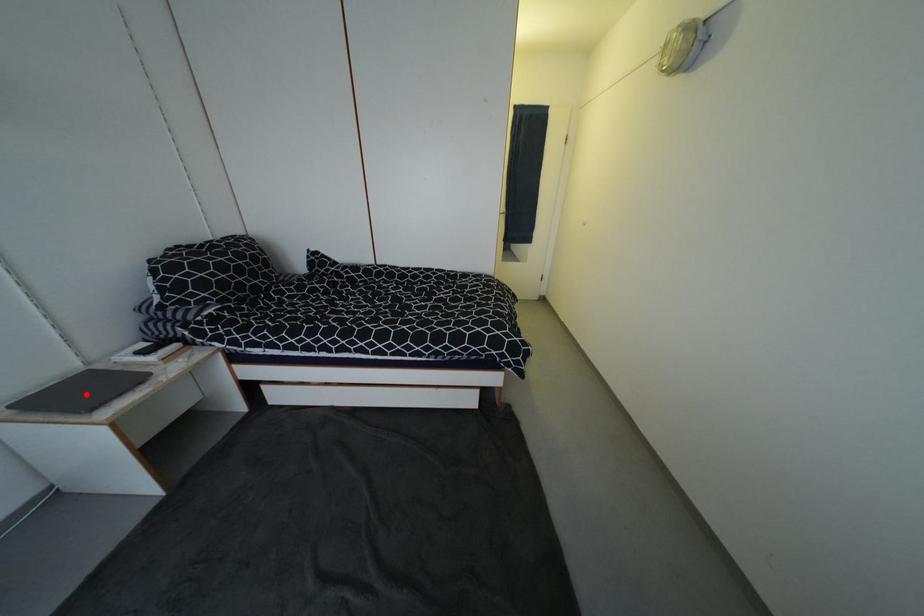
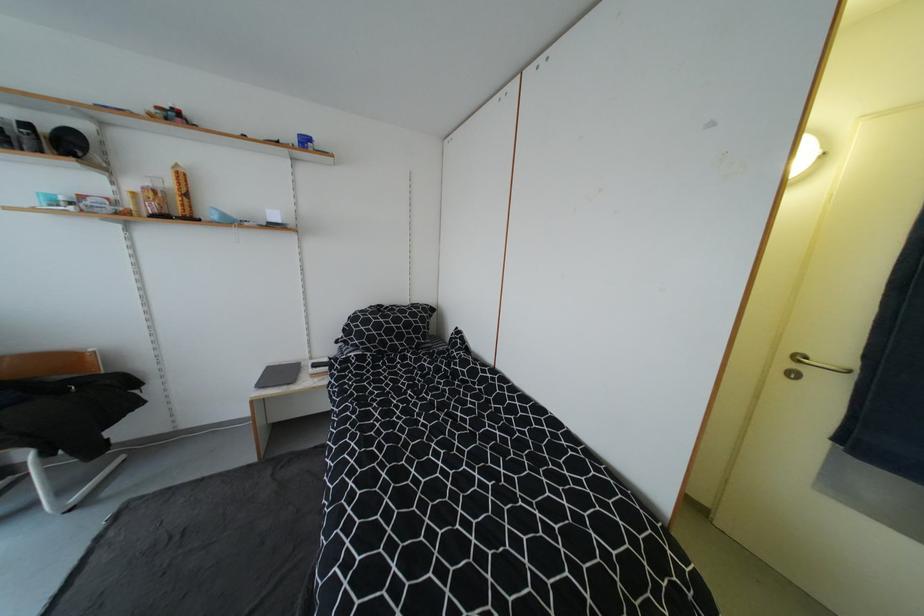
Locate, in the second image, the point that corresponds to the highlighted location in the first image.

(286, 376)